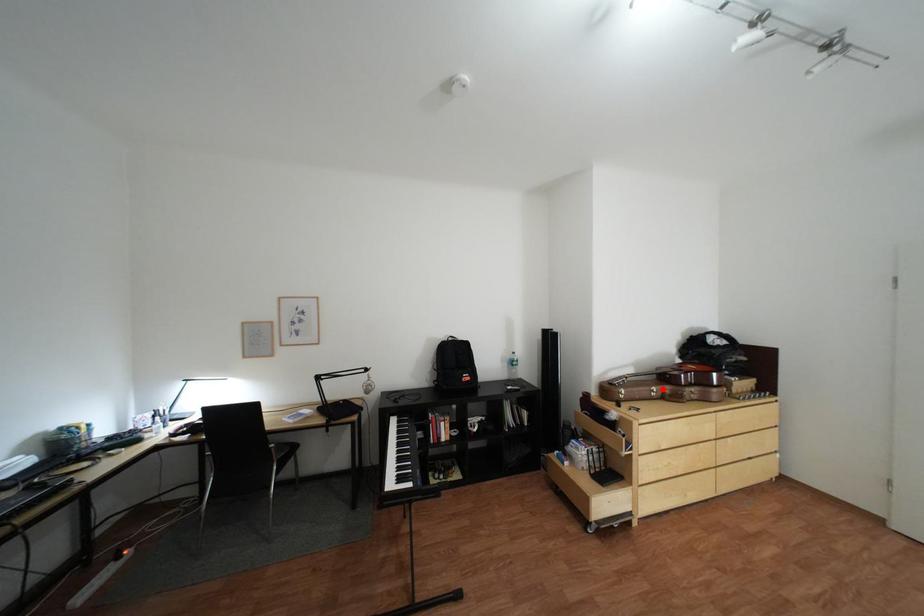
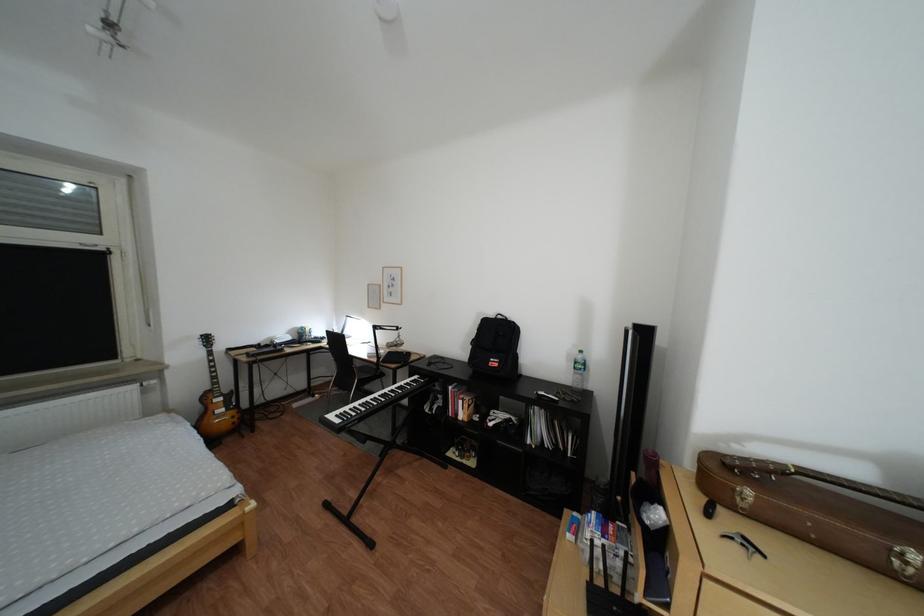
Question: I am providing you with two images of the same scene from different viewpoints. Image1 has a red point marked. In image2, the corresponding 3D location appears at what relative position? Reply with the corresponding letter.

Choices:
 (A) Closer
 (B) Farther

Answer: (A)